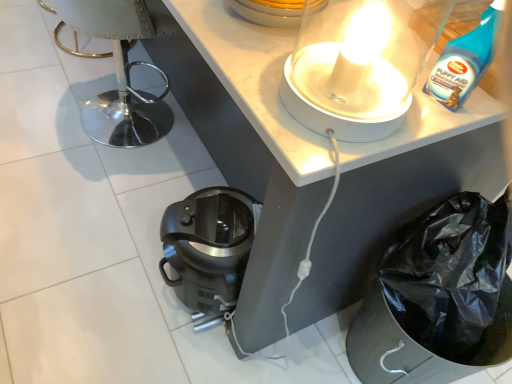
Identify the location of free region on the left part of metallic silver swivel chair at left. The height and width of the screenshot is (384, 512). (37, 86).